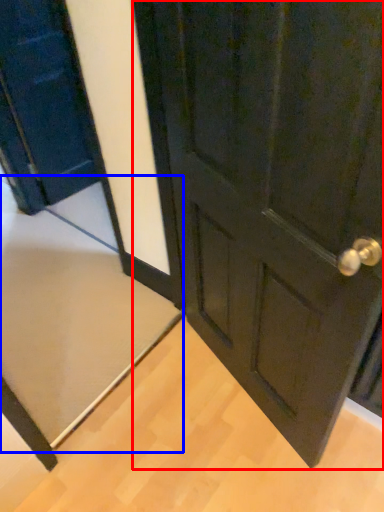
Question: Which object appears farthest to the camera in this image, door (highlighted by a red box) or doormat (highlighted by a blue box)?

Choices:
 (A) door
 (B) doormat

Answer: (B)